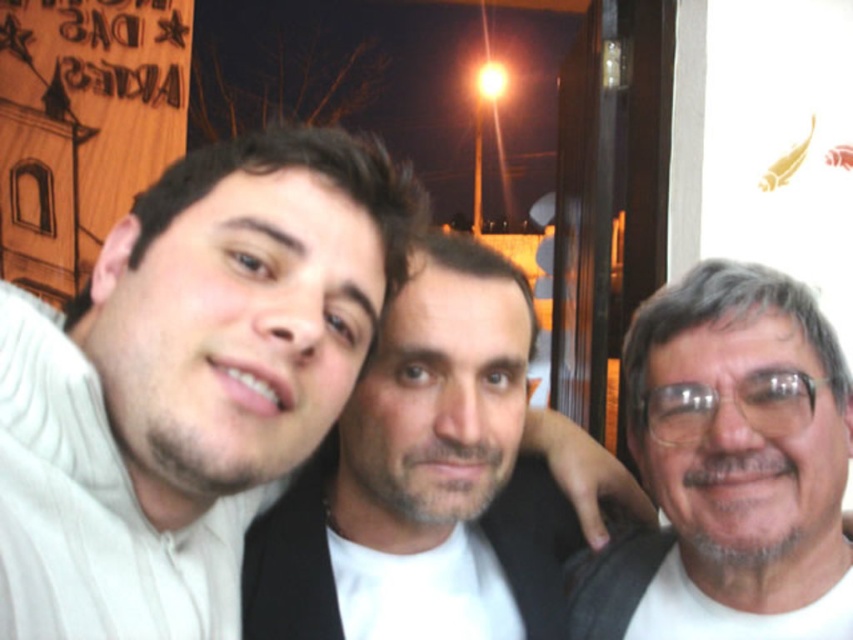
Question: Among these points, which one is farthest from the camera?

Choices:
 (A) (737, 628)
 (B) (198, 636)
 (C) (456, 392)
 (D) (683, 388)

Answer: (A)

Question: Considering the relative positions of white matte glasses at right and transparent plastic glasses at right in the image provided, where is white matte glasses at right located with respect to transparent plastic glasses at right?

Choices:
 (A) right
 (B) left

Answer: (A)

Question: Based on their relative distances, which object is farther from the white matte glasses at right?

Choices:
 (A) transparent plastic glasses at right
 (B) white matte sweater at left

Answer: (B)

Question: Is smooth skin face at center thinner than white matte glasses at right?

Choices:
 (A) yes
 (B) no

Answer: (B)

Question: Does white matte sweater at left have a smaller size compared to smooth skin face at center?

Choices:
 (A) no
 (B) yes

Answer: (B)

Question: Which point appears farthest from the camera in this image?

Choices:
 (A) (698, 403)
 (B) (242, 141)
 (C) (552, 502)
 (D) (654, 532)

Answer: (C)